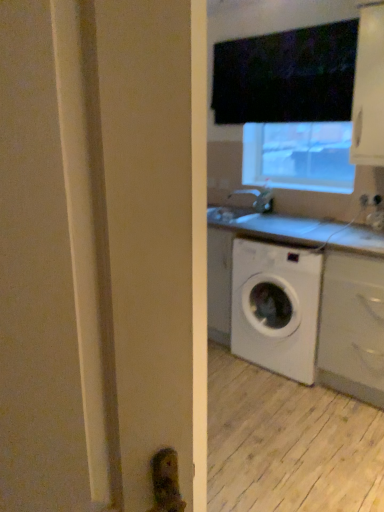
Question: Is white matte cabinet at lower right, positioned as the first cabinetry in bottom-to-top order, taller or shorter than matte silver faucet at center?

Choices:
 (A) tall
 (B) short

Answer: (A)

Question: Is white matte cabinet at lower right, positioned as the first cabinetry in bottom-to-top order, bigger or smaller than matte silver faucet at center?

Choices:
 (A) small
 (B) big

Answer: (B)

Question: Which is farther from the white matte cabinet at lower right, positioned as the first cabinetry in bottom-to-top order?

Choices:
 (A) matte silver faucet at center
 (B) white glossy counter at center
 (C) white plastic electric outlet at upper right
 (D) white glossy cabinet at upper right, the second cabinetry positioned from the bottom

Answer: (A)

Question: Based on their relative distances, which object is nearer to the white plastic electric outlet at upper right?

Choices:
 (A) white glossy cabinet at upper right, the second cabinetry positioned from the bottom
 (B) white glossy counter at center
 (C) matte silver faucet at center
 (D) white matte cabinet at lower right, positioned as the first cabinetry in bottom-to-top order

Answer: (A)